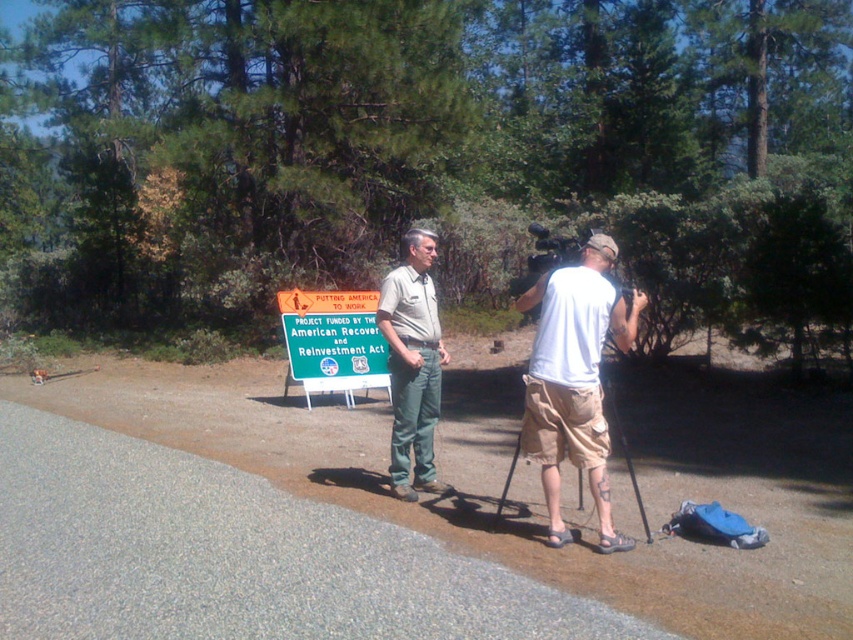
Can you confirm if khaki uniform pants at center is shorter than black metal tripod at center?

Incorrect, khaki uniform pants at center's height does not fall short of black metal tripod at center's.

In the scene shown: Between khaki uniform pants at center and black metal tripod at center, which one is positioned lower?

black metal tripod at center is lower down.

This screenshot has width=853, height=640. Describe the element at coordinates (412, 364) in the screenshot. I see `khaki uniform pants at center` at that location.

What are the coordinates of `khaki uniform pants at center` in the screenshot? It's located at (412, 364).

Does khaki uniform pants at center have a greater width compared to green matte sign at center?

In fact, khaki uniform pants at center might be narrower than green matte sign at center.

Is point (415, 332) farther from viewer compared to point (322, 362)?

No, (415, 332) is closer to viewer.

The image size is (853, 640). What are the coordinates of `khaki uniform pants at center` in the screenshot? It's located at (412, 364).

Does green matte sign at center come behind black metal tripod at center?

Yes, green matte sign at center is behind black metal tripod at center.

Between green matte sign at center and black metal tripod at center, which one appears on the left side from the viewer's perspective?

green matte sign at center

Is point (364, 388) more distant than point (637, 497)?

Yes, it is behind point (637, 497).

Where is `green matte sign at center`? green matte sign at center is located at coordinates (334, 342).